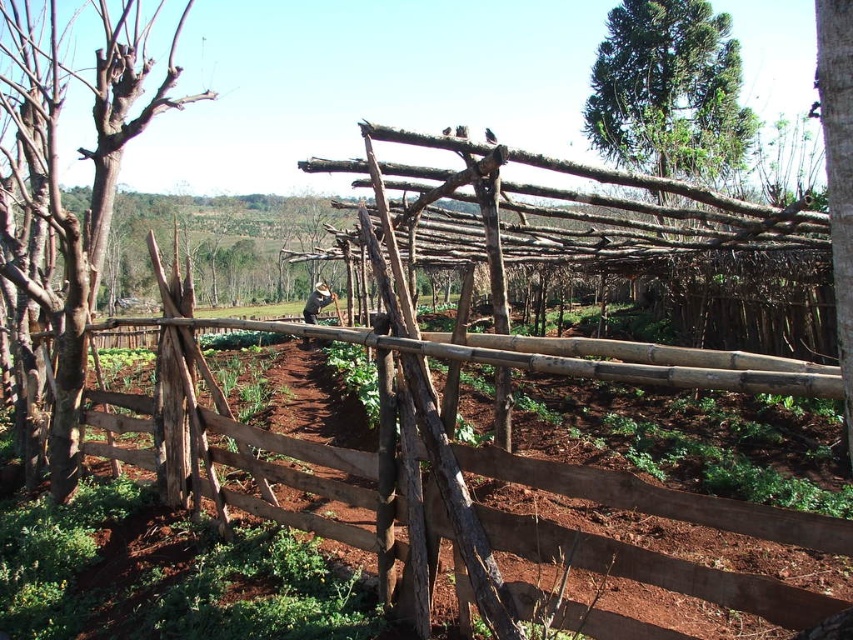
You are standing in the middle of the field and see the bare wood tree at left and the brown rough bark tree at right. Which tree is closer to your left side?

The bare wood tree at left is closer to your left side because it is positioned on the left side of the brown rough bark tree at right.

You are a farmer standing at the edge of your field. You need to determine which object is taller between the brown wooden fence at center and the brown rough bark tree at right. Based on the scene, which one is taller?

The brown rough bark tree at right is taller than the brown wooden fence at center according to the description.

Based on the photo, you are a drone operator trying to capture an aerial view of the farm. The brown wooden fence at center and the green textured tree at upper right are in your camera frame. Which object appears taller in the image?

The green textured tree at upper right appears taller than the brown wooden fence at center in the image.